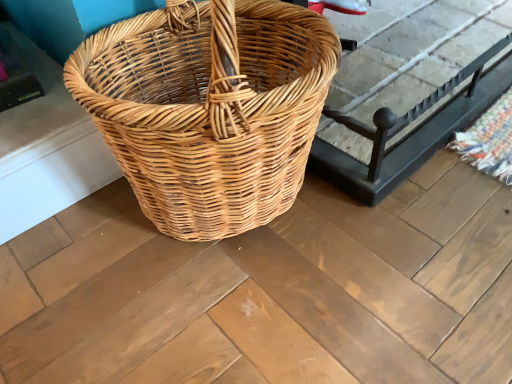
Question: Considering their positions, is natural wicker basket at center located in front of or behind natural wicker picnic basket at center?

Choices:
 (A) front
 (B) behind

Answer: (B)

Question: Is point (369, 195) closer or farther from the camera than point (99, 86)?

Choices:
 (A) farther
 (B) closer

Answer: (A)

Question: From the image's perspective, relative to natural wicker picnic basket at center, is natural wicker basket at center above or below?

Choices:
 (A) above
 (B) below

Answer: (A)

Question: Considering the relative positions of natural wicker picnic basket at center and natural wicker basket at center in the image provided, is natural wicker picnic basket at center to the left or to the right of natural wicker basket at center?

Choices:
 (A) right
 (B) left

Answer: (B)

Question: From a real-world perspective, is natural wicker picnic basket at center positioned above or below natural wicker basket at center?

Choices:
 (A) above
 (B) below

Answer: (A)

Question: Is natural wicker picnic basket at center inside the boundaries of natural wicker basket at center, or outside?

Choices:
 (A) inside
 (B) outside

Answer: (B)

Question: Considering their positions, is natural wicker picnic basket at center located in front of or behind natural wicker basket at center?

Choices:
 (A) front
 (B) behind

Answer: (A)